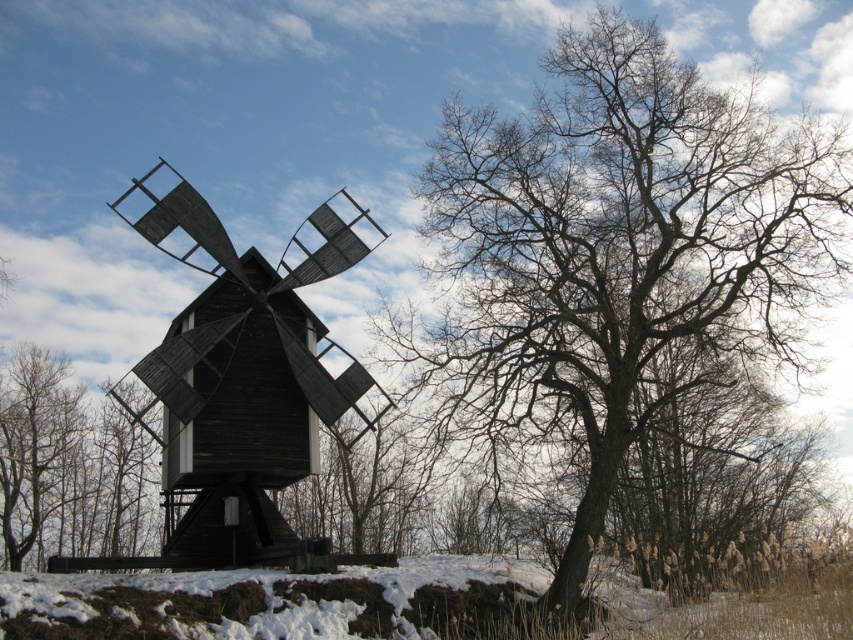
You are an architect planning to build a new cabin near the dark wood windmill at center and the brown wood tree at left. Considering their sizes, which structure should you avoid placing additional heavy equipment near to prevent damage?

You should avoid placing additional heavy equipment near the dark wood windmill at center because it has a larger size compared to the brown wood tree at left, making it potentially more vulnerable to structural stress from heavy equipment.

You are standing at the point marked with coordinates point (242, 385). Looking around, you see the dark wood windmill at center. Which direction should you face to look towards the windmill?

→ You are already facing the dark wood windmill at center because the point (242, 385) indicates that you are standing at the location of the dark wood windmill at center.

You are standing in front of the rustic windmill and want to determine the relative positions of two points marked in the image. Which point, point [161,566] or point [6,476], is closer to you?

Point [161,566] is closer to the viewer than point [6,476].